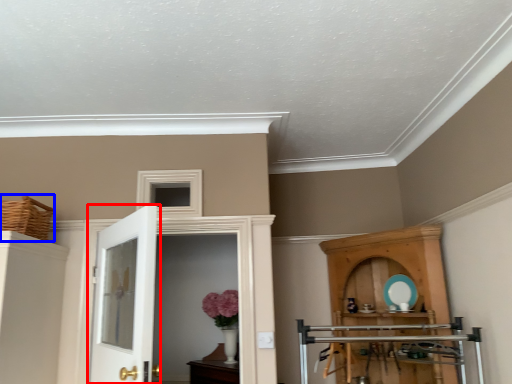
Question: Which object is closer to the camera taking this photo, door (highlighted by a red box) or basket (highlighted by a blue box)?

Choices:
 (A) door
 (B) basket

Answer: (A)